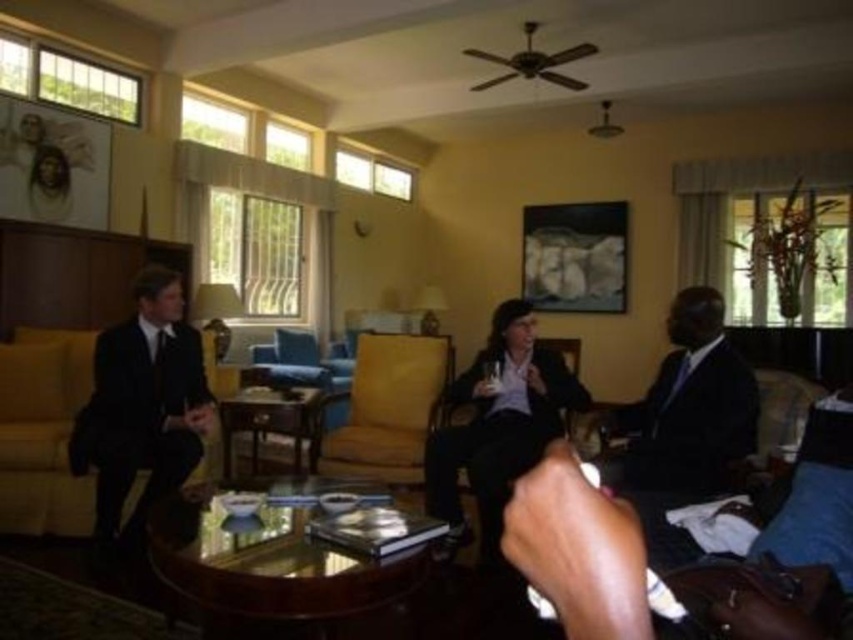
You are a server at a formal event and need to place a 16 inch wide tray between the matte black armchair at center and the yellow fabric armchair at center. Can the tray fit between them without touching either chair?

The distance between the matte black armchair at center and the yellow fabric armchair at center is 17.53 inches. Since the tray is 16 inches wide, it can fit between them as there is enough space.

You are organizing a meeting and need to seat a guest who requires a seat wider than 1.2 meters. You have a matte black suit at right and a matte black couch at left available. Which object can accommodate the guest?

The matte black couch at left is wider than the matte black suit at right. Since the guest requires a seat wider than 1.2 meters, the matte black couch at left should be checked for its width to see if it meets the requirement.